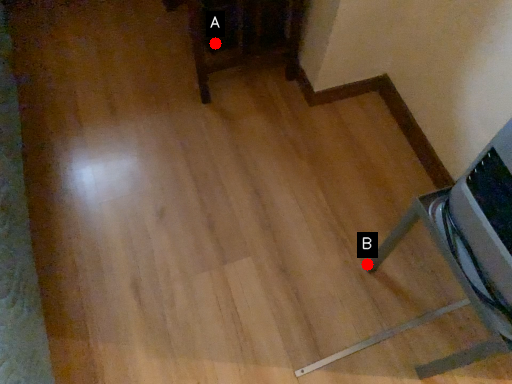
Question: Two points are circled on the image, labeled by A and B beside each circle. Among these points, which one is farthest from the camera?

Choices:
 (A) A is further
 (B) B is further

Answer: (A)